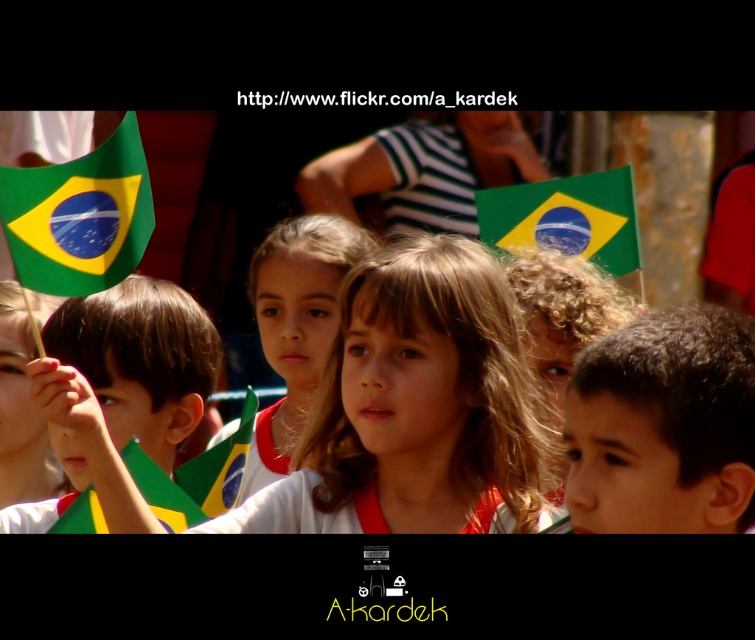
You are a photographer trying to capture a candid shot of the children holding the Brazilian flags. You notice a point at coordinates point (415, 406). Where is this point located in the scene?

The point (415, 406) is located on brown hair at center.

You are a photographer at the event. You want to take a photo of the short brown hair boy at center and the green felt flag at left. Can you position yourself so that the boy is visible in front of the flag without any obstruction?

Yes, because the short brown hair boy at center is already positioned in front of the green felt flag at left, so you can frame the shot to show him clearly in front of the flag without obstruction.

You are a photographer trying to capture a clear shot of both the green felt flag at left and the matte white shirt at center. Given their sizes, which object should you focus on first to ensure it fits entirely within the frame?

The green felt flag at left is shorter than the matte white shirt at center, so you should focus on the matte white shirt at center first to ensure it fits entirely within the frame since it is taller.